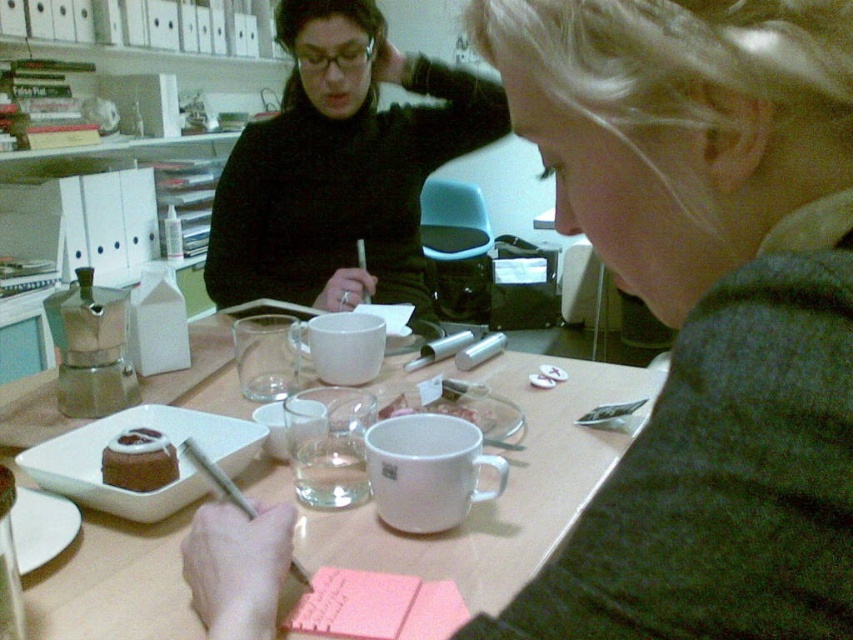
Which of these two, black matte sweater at upper center or white matte table at center, stands taller?

black matte sweater at upper center is taller.

Does black matte sweater at upper center have a greater width compared to white matte table at center?

No, black matte sweater at upper center is not wider than white matte table at center.

Locate an element on the screen. This screenshot has height=640, width=853. black matte sweater at upper center is located at coordinates (341, 166).

Between black matte sweater at upper center and chocolate frosted cake at center, which one has less height?

chocolate frosted cake at center is shorter.

Who is more distant from viewer, (287,164) or (134,432)?

The point (287,164) is more distant.

Describe the element at coordinates (341, 166) in the screenshot. I see `black matte sweater at upper center` at that location.

Find the location of `black matte sweater at upper center`. black matte sweater at upper center is located at coordinates (341, 166).

Which is in front, point (605, 476) or point (160, 461)?

Point (160, 461)

Who is taller, white matte table at center or chocolate frosted cake at center?

With more height is white matte table at center.

Measure the distance between point (434, 371) and camera.

4.25 feet

Image resolution: width=853 pixels, height=640 pixels. I want to click on white matte table at center, so point(508,486).